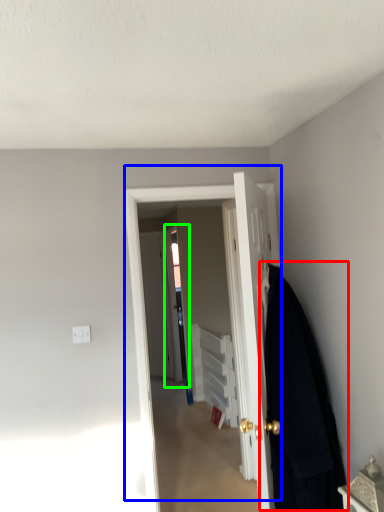
Question: Which is nearer to the blanket (highlighted by a red box)? door (highlighted by a blue box) or screen door (highlighted by a green box).

Choices:
 (A) door
 (B) screen door

Answer: (A)